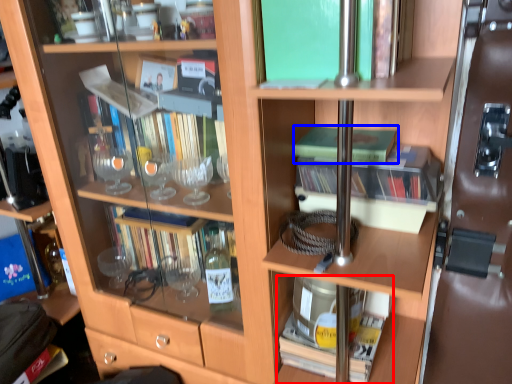
Question: Which point is closer to the camera, book (highlighted by a red box) or book (highlighted by a blue box)?

Choices:
 (A) book
 (B) book

Answer: (B)